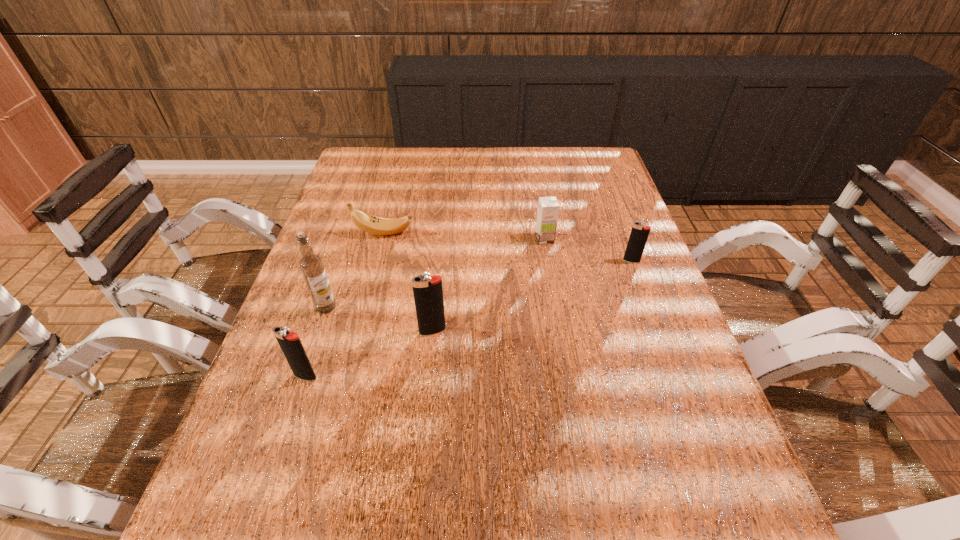
At what (x,y) coordinates should I click in order to perform the action: click on vacant area between the leftmost igniter and the banana. Please return your answer as a coordinate pair (x, y). Looking at the image, I should click on (345, 305).

I want to click on free space between the nearest igniter and the banana, so click(345, 305).

At what (x,y) coordinates should I click in order to perform the action: click on vacant space in between the second igniter from left to right and the second object from right to left. Please return your answer as a coordinate pair (x, y). The image size is (960, 540). Looking at the image, I should click on (489, 285).

I want to click on vacant space that is in between the fourth nearest object and the second object from right to left, so click(588, 250).

What are the coordinates of `object that stands as the third closest to the nearest igniter` in the screenshot? It's located at (371, 224).

Locate which object is the closest to the second shortest igniter. Please provide its 2D coordinates. Your answer should be formatted as a tuple, i.e. [(x, y)], where the tuple contains the x and y coordinates of a point satisfying the conditions above.

[(311, 265)]

The image size is (960, 540). What are the coordinates of `igniter identified as the closest to the third nearest object` in the screenshot? It's located at (290, 343).

Identify which igniter is located as the second nearest to the shortest igniter. Please provide its 2D coordinates. Your answer should be formatted as a tuple, i.e. [(x, y)], where the tuple contains the x and y coordinates of a point satisfying the conditions above.

[(290, 343)]

This screenshot has height=540, width=960. What are the coordinates of `free space that satisfies the following two spatial constraints: 1. on the front side of the banana; 2. on the left side of the rightmost igniter` in the screenshot? It's located at (376, 261).